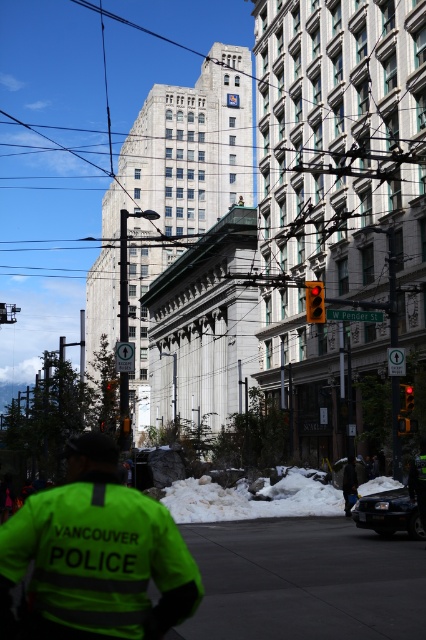
Does neon yellow reflective vest at center have a greater height compared to neon yellow reflective jacket at lower center?

Yes, neon yellow reflective vest at center is taller than neon yellow reflective jacket at lower center.

At what (x,y) coordinates should I click in order to perform the action: click on neon yellow reflective vest at center. Please return your answer as a coordinate pair (x, y). Looking at the image, I should click on (97, 554).

I want to click on neon yellow reflective vest at center, so click(x=97, y=554).